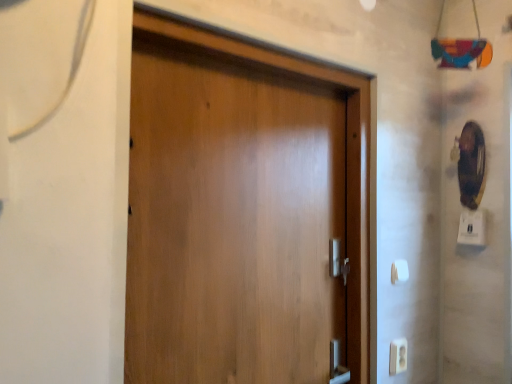
Question: From a real-world perspective, is white plastic electric outlet at lower right physically located above or below white plastic light switch at lower right, marked as the 1th light switch in a left-to-right arrangement?

Choices:
 (A) above
 (B) below

Answer: (B)

Question: In the image, is white plastic electric outlet at lower right positioned in front of or behind white plastic light switch at lower right, marked as the 2th light switch in a top-to-bottom arrangement?

Choices:
 (A) front
 (B) behind

Answer: (A)

Question: Which object is positioned farthest from the white plastic light switch at lower right, marked as the 2th light switch in a top-to-bottom arrangement?

Choices:
 (A) wooden door at center
 (B) white plastic electric outlet at lower right
 (C) white plastic light switch at right, which appears as the 2th light switch when viewed from the left

Answer: (A)

Question: Based on their relative distances, which object is nearer to the white plastic light switch at lower right, marked as the 1th light switch in a left-to-right arrangement?

Choices:
 (A) wooden door at center
 (B) white plastic electric outlet at lower right
 (C) white plastic light switch at right, arranged as the 1th light switch when viewed from the top

Answer: (B)